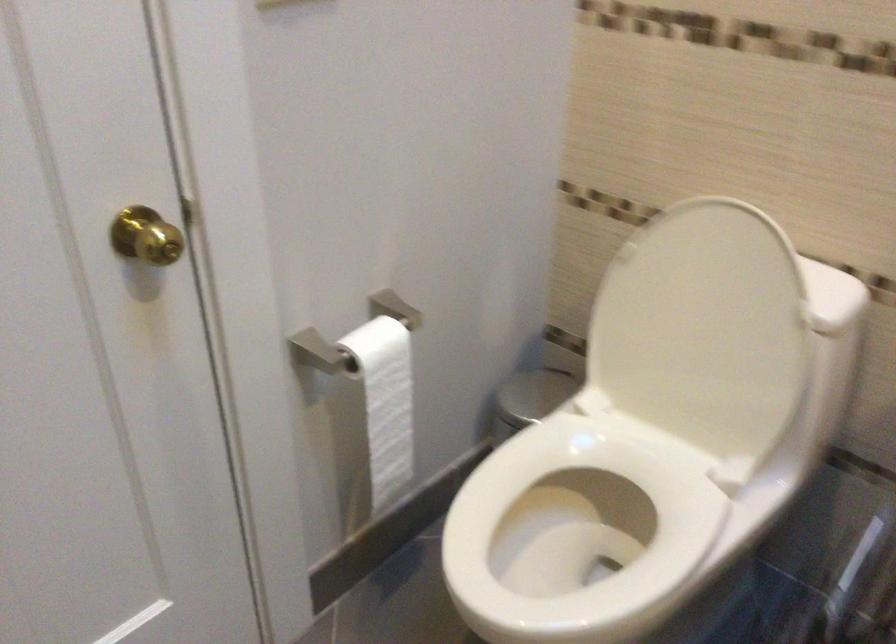
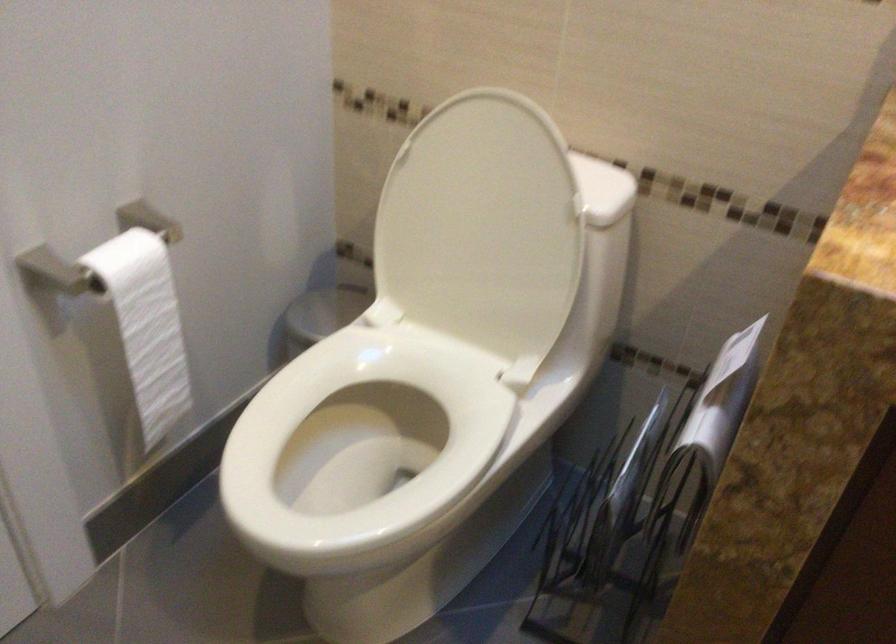
The point at (567,521) is marked in the first image. Where is the corresponding point in the second image?

(363, 438)